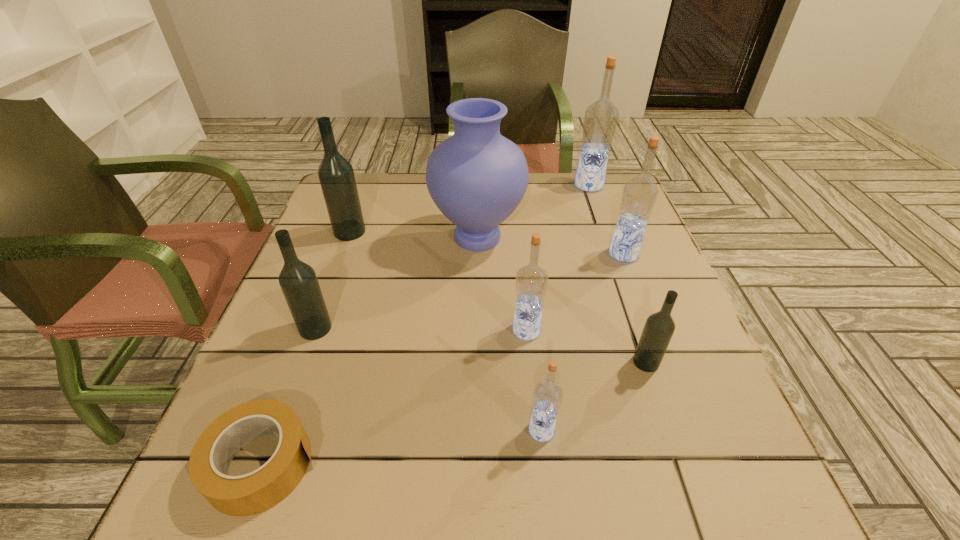
Where is `vacant position located 0.250m on the front of the rightmost black vodka`? The width and height of the screenshot is (960, 540). vacant position located 0.250m on the front of the rightmost black vodka is located at coordinates (699, 517).

Locate an element on the screen. free spot located on the back of the smallest blue vodka is located at coordinates (532, 345).

At what (x,y) coordinates should I click in order to perform the action: click on vacant space located 0.200m at the edge of the shortest object. Please return your answer as a coordinate pair (x, y). This screenshot has height=540, width=960. Looking at the image, I should click on (444, 464).

Identify the location of vodka that is at the far edge. Image resolution: width=960 pixels, height=540 pixels. (600, 121).

I want to click on vase present at the far edge, so click(x=477, y=177).

Find the location of a particular element. The image size is (960, 540). object that is positioned at the near edge is located at coordinates (255, 492).

In order to click on duct tape located at the left edge in this screenshot , I will do `click(255, 492)`.

The image size is (960, 540). Identify the location of object present at the near left corner. (255, 492).

The width and height of the screenshot is (960, 540). In order to click on object present at the far right corner in this screenshot , I will do `click(600, 121)`.

Find the location of `vacant position at the far edge of the desktop`. vacant position at the far edge of the desktop is located at coordinates (540, 181).